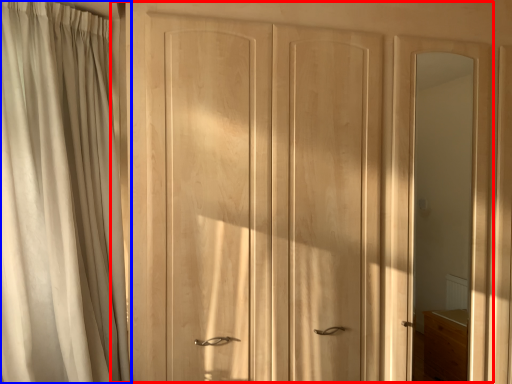
Question: Which point is further to the camera, door (highlighted by a red box) or curtain (highlighted by a blue box)?

Choices:
 (A) door
 (B) curtain

Answer: (A)